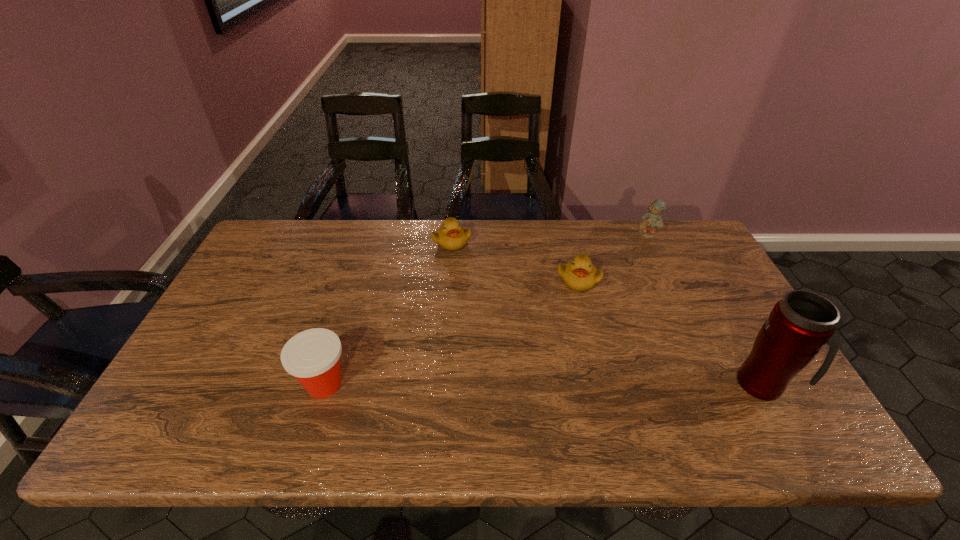
At what (x,y) coordinates should I click in order to perform the action: click on vacant space on the desktop that is between the leftmost object and the rightmost object and is positioned on the front-facing side of the nearer duckling. Please return your answer as a coordinate pair (x, y). The height and width of the screenshot is (540, 960). Looking at the image, I should click on (589, 384).

Locate an element on the screen. The height and width of the screenshot is (540, 960). vacant space on the desktop that is between the leftmost object and the thermos bottle and is positioned at the beak of the second object from left to right is located at coordinates (480, 384).

At what (x,y) coordinates should I click in order to perform the action: click on vacant spot on the desktop that is between the Dixie cup and the rightmost object and is positioned on the front-facing side of the second object from right to left. Please return your answer as a coordinate pair (x, y). Looking at the image, I should click on (582, 384).